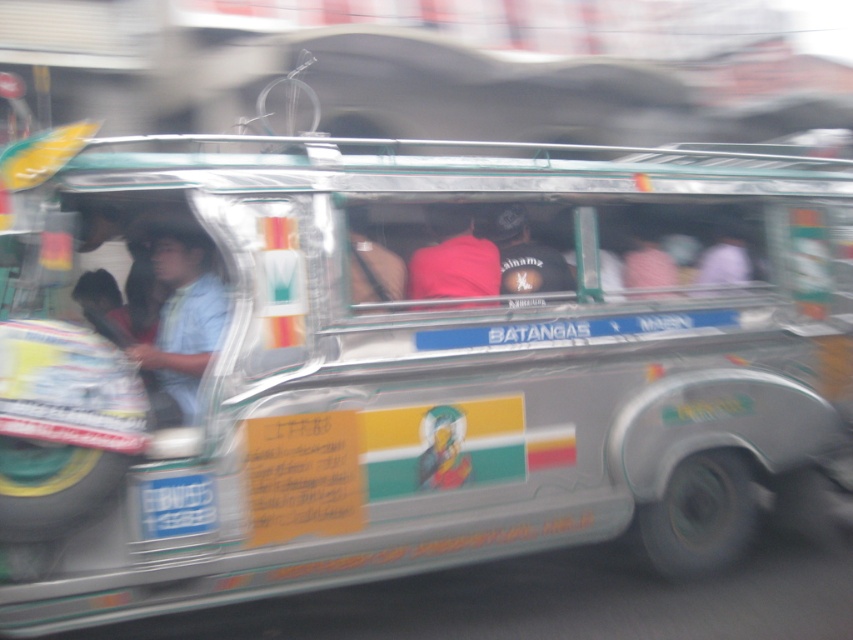
You are a passenger in the vehicle and need to determine where to place your bag. You have two options for storage space. One is the pink fabric at center, and the other is the dark gray fabric cap at center. Which storage space is higher up?

The pink fabric at center is located above the dark gray fabric cap at center, so the pink fabric at center is higher up.

You are a passenger in the silver vehicle and you want to sit down. There is a seat available at the center. Where exactly is the seat located in relation to the matte blue shirt at center?

The seat available at the center is located at the same position as the matte blue shirt at center, which is at point [183,324].